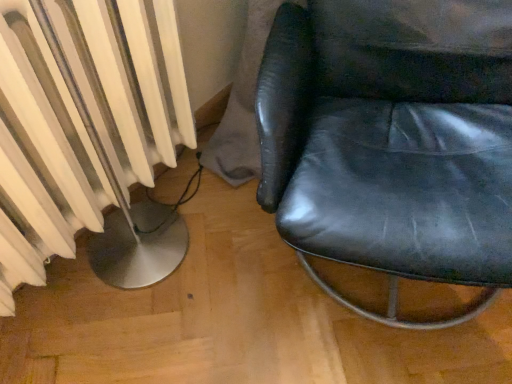
Question: From a real-world perspective, is black leather chair at right positioned under white matte radiator at left based on gravity?

Choices:
 (A) no
 (B) yes

Answer: (B)

Question: Is black leather chair at right positioned with its back to white matte radiator at left?

Choices:
 (A) yes
 (B) no

Answer: (B)

Question: Is black leather chair at right shorter than white matte radiator at left?

Choices:
 (A) no
 (B) yes

Answer: (A)

Question: Is black leather chair at right in front of white matte radiator at left?

Choices:
 (A) no
 (B) yes

Answer: (B)

Question: Considering the relative sizes of black leather chair at right and white matte radiator at left in the image provided, is black leather chair at right taller than white matte radiator at left?

Choices:
 (A) yes
 (B) no

Answer: (A)

Question: Is black leather chair at right at the left side of white matte radiator at left?

Choices:
 (A) yes
 (B) no

Answer: (B)

Question: Does white matte radiator at left appear on the left side of black leather chair at right?

Choices:
 (A) yes
 (B) no

Answer: (A)

Question: Is white matte radiator at left oriented towards black leather chair at right?

Choices:
 (A) no
 (B) yes

Answer: (B)

Question: Considering the relative sizes of white matte radiator at left and black leather chair at right in the image provided, is white matte radiator at left bigger than black leather chair at right?

Choices:
 (A) no
 (B) yes

Answer: (A)

Question: Is white matte radiator at left smaller than black leather chair at right?

Choices:
 (A) yes
 (B) no

Answer: (A)

Question: From a real-world perspective, is white matte radiator at left positioned over black leather chair at right based on gravity?

Choices:
 (A) no
 (B) yes

Answer: (B)

Question: Can you confirm if white matte radiator at left is wider than black leather chair at right?

Choices:
 (A) no
 (B) yes

Answer: (A)

Question: Do you think white matte radiator at left is within black leather chair at right, or outside of it?

Choices:
 (A) inside
 (B) outside

Answer: (B)